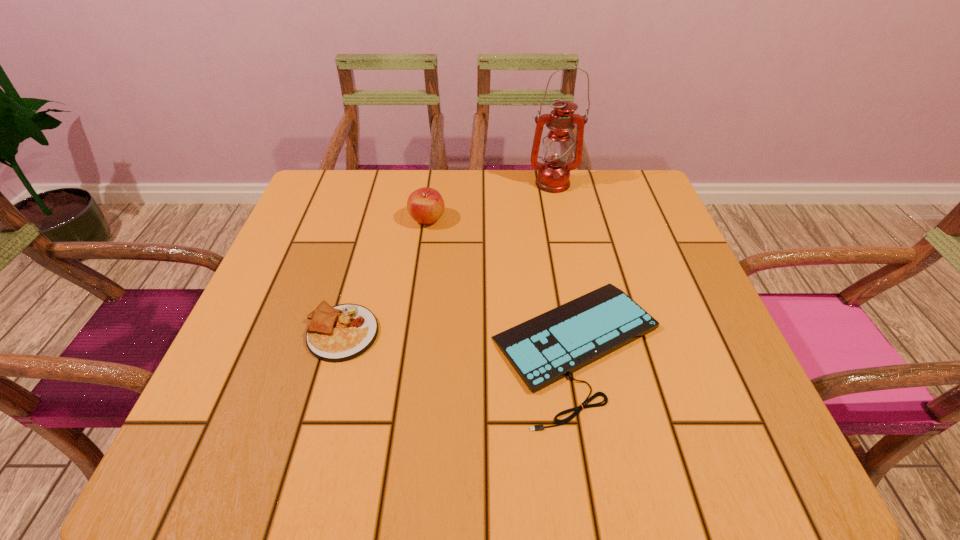
Locate an element on the screen. The height and width of the screenshot is (540, 960). vacant space at the right edge of the desktop is located at coordinates (682, 340).

Find the location of `vacant space at the far left corner of the desktop`. vacant space at the far left corner of the desktop is located at coordinates (317, 185).

I want to click on free space at the far right corner, so click(x=654, y=199).

You are a GUI agent. You are given a task and a screenshot of the screen. Output one action in this format:
    pyautogui.click(x=<x>, y=<y>)
    Task: Click on the empty space that is in between the oil lamp and the third object from right to left
    The width and height of the screenshot is (960, 540).
    Given the screenshot: What is the action you would take?
    pyautogui.click(x=490, y=201)

This screenshot has height=540, width=960. Identify the location of vacant area between the farthest object and the third shortest object. (490, 201).

This screenshot has width=960, height=540. In order to click on free area in between the third nearest object and the shortest object in this screenshot , I will do `click(502, 284)`.

This screenshot has width=960, height=540. I want to click on empty space that is in between the computer keyboard and the oil lamp, so click(x=564, y=265).

Find the location of `vacant space in between the third shortest object and the shortest object`. vacant space in between the third shortest object and the shortest object is located at coordinates (502, 284).

At what (x,y) coordinates should I click in order to perform the action: click on free space between the third object from right to left and the oil lamp. Please return your answer as a coordinate pair (x, y). Looking at the image, I should click on (490, 201).

Identify the location of free space that is in between the shortest object and the leftmost object. pos(460,340).